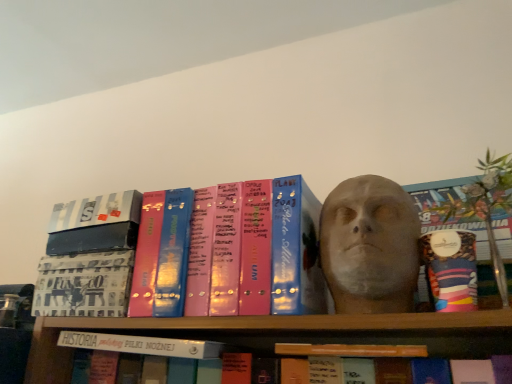
What do you see at coordinates (141, 345) in the screenshot?
I see `white matte book at center, the third book viewed from the left` at bounding box center [141, 345].

Where is `metallic silver book at upper left, which appears as the fourth book when viewed from the right`? Image resolution: width=512 pixels, height=384 pixels. metallic silver book at upper left, which appears as the fourth book when viewed from the right is located at coordinates (96, 211).

Describe the element at coordinates (370, 240) in the screenshot. This screenshot has height=384, width=512. I see `matte gray sculpture at center` at that location.

What do you see at coordinates (84, 284) in the screenshot? The width and height of the screenshot is (512, 384). I see `patterned fabric book at center, the 5th book in the right-to-left sequence` at bounding box center [84, 284].

Measure the distance between point (486,199) and camera.

The distance of point (486,199) from camera is 71.30 centimeters.

The height and width of the screenshot is (384, 512). In order to click on white matte book at center, the third book viewed from the left in this screenshot , I will do `click(141, 345)`.

Is patterned fabric book at center, the 5th book in the right-to-left sequence, far from green leafy plant at upper right?

patterned fabric book at center, the 5th book in the right-to-left sequence, is actually quite close to green leafy plant at upper right.

Which of these two, patterned fabric book at center, the 5th book in the right-to-left sequence, or green leafy plant at upper right, is bigger?

Bigger between the two is green leafy plant at upper right.

From a real-world perspective, is patterned fabric book at center, the 5th book in the right-to-left sequence, on top of green leafy plant at upper right?

Incorrect, from a real-world perspective, patterned fabric book at center, the 5th book in the right-to-left sequence, is lower than green leafy plant at upper right.

Which point is more forward, (199, 279) or (71, 212)?

The point (199, 279) is in front.

Between matte pink binder at center, the 4th book from the left, and metallic silver book at upper left, which appears as the fourth book when viewed from the right, which one has smaller width?

matte pink binder at center, the 4th book from the left.

Does matte pink binder at center, arranged as the second book when viewed from the right, have a smaller size compared to metallic silver book at upper left, which appears as the second book when viewed from the left?

No.

From the image's perspective, count 1st books downward from the green leafy plant at upper right and point to it. Please provide its 2D coordinates.

[(96, 211)]

Which is further, [134,214] or [481,169]?

Point [481,169]

Based on the photo, can you confirm if metallic silver book at upper left, which appears as the second book when viewed from the left, is positioned to the right of green leafy plant at upper right?

No, metallic silver book at upper left, which appears as the second book when viewed from the left, is not to the right of green leafy plant at upper right.

From a real-world perspective, is metallic silver book at upper left, which appears as the second book when viewed from the left, over green leafy plant at upper right?

Yes.

What's the angular difference between matte pink binder at center, the 4th book from the left, and green leafy plant at upper right's facing directions?

The angular difference between matte pink binder at center, the 4th book from the left, and green leafy plant at upper right is 0.000254 degrees.

Is point (292, 221) positioned after point (469, 191)?

No, it is in front of (469, 191).

From a real-world perspective, which object stands above the other?

green leafy plant at upper right.

Considering the relative sizes of matte pink binder at center, arranged as the second book when viewed from the right, and green leafy plant at upper right in the image provided, is matte pink binder at center, arranged as the second book when viewed from the right, thinner than green leafy plant at upper right?

In fact, matte pink binder at center, arranged as the second book when viewed from the right, might be wider than green leafy plant at upper right.

Starting from the matte gray sculpture at center, which book is the 4th one behind? Please provide its 2D coordinates.

[(84, 284)]

Would you say patterned fabric book at center, the 5th book in the right-to-left sequence, is inside or outside matte gray sculpture at center?

patterned fabric book at center, the 5th book in the right-to-left sequence, exists outside the volume of matte gray sculpture at center.

From the image's perspective, is patterned fabric book at center, acting as the first book starting from the left, above or below matte gray sculpture at center?

From the image's perspective, patterned fabric book at center, acting as the first book starting from the left, appears below matte gray sculpture at center.

How far apart are patterned fabric book at center, acting as the first book starting from the left, and matte gray sculpture at center?

patterned fabric book at center, acting as the first book starting from the left, and matte gray sculpture at center are 16.62 inches apart.

Based on their sizes in the image, would you say green leafy plant at upper right is bigger or smaller than matte gray sculpture at center?

In the image, green leafy plant at upper right appears to be larger than matte gray sculpture at center.

Is point (498, 161) farther from camera compared to point (385, 183)?

Yes, point (498, 161) is farther from viewer.

This screenshot has width=512, height=384. Identify the location of human face beneath the green leafy plant at upper right (from a real-world perspective). (370, 240).

Considering their positions, is green leafy plant at upper right located in front of or behind white matte book at center, marked as the 3th book in a right-to-left arrangement?

In the image, green leafy plant at upper right appears in front of white matte book at center, marked as the 3th book in a right-to-left arrangement.

Is point (495, 255) closer or farther from the camera than point (119, 340)?

Point (495, 255).

This screenshot has height=384, width=512. Find the location of `the 3rd book behind the green leafy plant at upper right`. the 3rd book behind the green leafy plant at upper right is located at coordinates (141, 345).

Is green leafy plant at upper right taller than white matte book at center, marked as the 3th book in a right-to-left arrangement?

Yes.

I want to click on book that is the 4th object located behind the green leafy plant at upper right, so click(x=84, y=284).

At what (x,y) coordinates should I click in order to perform the action: click on book that is the 1st object directly below the metallic silver book at upper left, which appears as the second book when viewed from the left (from a real-world perspective). Please return your answer as a coordinate pair (x, y). The width and height of the screenshot is (512, 384). Looking at the image, I should click on (254, 250).

When comparing their distances from metallic silver book at upper left, which appears as the fourth book when viewed from the right, does patterned fabric book at center, acting as the first book starting from the left, or white matte book at center, marked as the 3th book in a right-to-left arrangement, seem closer?

The object closer to metallic silver book at upper left, which appears as the fourth book when viewed from the right, is patterned fabric book at center, acting as the first book starting from the left.

Based on the photo, from the image, which object appears to be nearer to matte pink binder at center, the 4th book from the left, patterned fabric book at center, the 5th book in the right-to-left sequence, or metallic silver book at upper left, which appears as the second book when viewed from the left?

patterned fabric book at center, the 5th book in the right-to-left sequence, is positioned closer to the anchor matte pink binder at center, the 4th book from the left.

In the scene shown: Based on their spatial positions, is metallic silver book at upper left, which appears as the second book when viewed from the left, or green leafy plant at upper right closer to matte pink binder at center, the 4th book from the left?

metallic silver book at upper left, which appears as the second book when viewed from the left, is closer to matte pink binder at center, the 4th book from the left.

Which object lies further to the anchor point patterned fabric book at center, acting as the first book starting from the left, matte gray sculpture at center or green leafy plant at upper right?

green leafy plant at upper right is positioned further to the anchor patterned fabric book at center, acting as the first book starting from the left.

Which object lies further to the anchor point orange matte book at center, which is the 1th book from right to left, metallic silver book at upper left, which appears as the second book when viewed from the left, or white matte book at center, the third book viewed from the left?

metallic silver book at upper left, which appears as the second book when viewed from the left, lies further to orange matte book at center, which is the 1th book from right to left, than the other object.

When comparing their distances from matte pink binder at center, arranged as the second book when viewed from the right, does orange matte book at center, which is the 1th book from right to left, or green leafy plant at upper right seem further?

green leafy plant at upper right is positioned further to the anchor matte pink binder at center, arranged as the second book when viewed from the right.

Looking at the image, which one is located closer to patterned fabric book at center, acting as the first book starting from the left, orange matte book at center, which is the 1th book from right to left, or matte pink binder at center, arranged as the second book when viewed from the right?

Based on the image, matte pink binder at center, arranged as the second book when viewed from the right, appears to be nearer to patterned fabric book at center, acting as the first book starting from the left.

Which object lies nearer to the anchor point white matte book at center, the third book viewed from the left, matte gray sculpture at center or matte pink binder at center, the 4th book from the left?

matte pink binder at center, the 4th book from the left, lies closer to white matte book at center, the third book viewed from the left, than the other object.

Where is `human face located between orange matte book at center, which is the 1th book from right to left, and green leafy plant at upper right in the left-right direction`? human face located between orange matte book at center, which is the 1th book from right to left, and green leafy plant at upper right in the left-right direction is located at coordinates (370, 240).

Identify the location of book between matte pink binder at center, the 4th book from the left, and green leafy plant at upper right. This screenshot has width=512, height=384. pos(351,350).

Identify the location of human face situated between metallic silver book at upper left, which appears as the fourth book when viewed from the right, and green leafy plant at upper right from left to right. (370, 240).

At what (x,y) coordinates should I click in order to perform the action: click on human face between matte pink binder at center, arranged as the second book when viewed from the right, and green leafy plant at upper right from left to right. Please return your answer as a coordinate pair (x, y). Looking at the image, I should click on (370, 240).